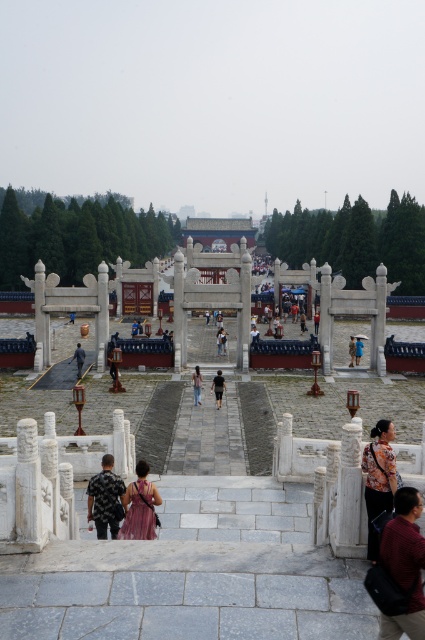
Question: Is denim jeans at center further to the viewer compared to dark gray fabric person at center?

Choices:
 (A) yes
 (B) no

Answer: (B)

Question: Which object is closer to the camera taking this photo?

Choices:
 (A) patterned fabric shirt at lower left
 (B) pink satin dress at center
 (C) blue fabric umbrella at center

Answer: (B)

Question: Does patterned fabric shirt at lower left appear over dark gray fabric at center?

Choices:
 (A) yes
 (B) no

Answer: (B)

Question: Does maroon fabric shirt at lower right appear on the left side of dark gray fabric person at center?

Choices:
 (A) no
 (B) yes

Answer: (A)

Question: Among these points, which one is farthest from the camera?

Choices:
 (A) (382, 492)
 (B) (139, 474)
 (C) (90, 509)
 (D) (217, 371)

Answer: (D)

Question: Which point appears farthest from the camera in this image?

Choices:
 (A) (112, 456)
 (B) (133, 493)
 (C) (359, 348)
 (D) (201, 376)

Answer: (C)